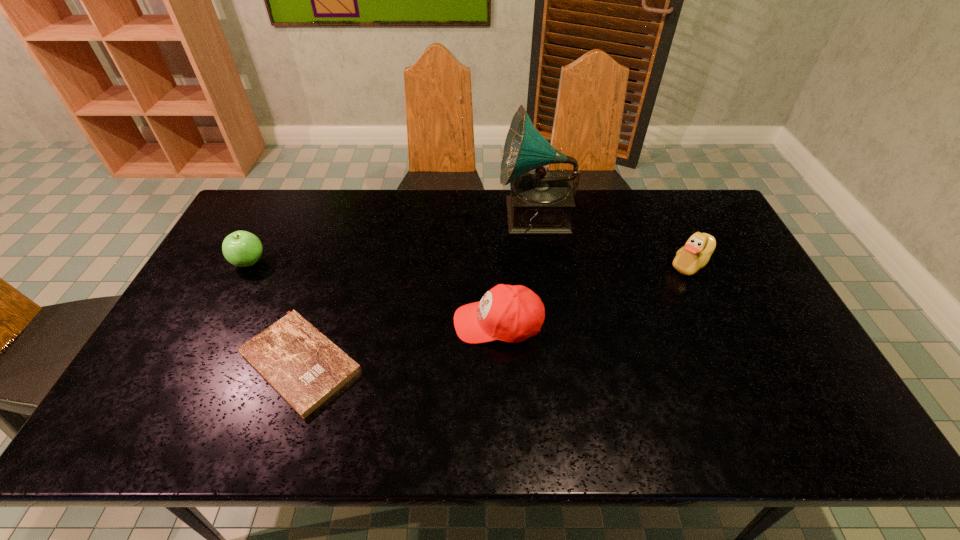
Find the location of a particular element. This screenshot has height=540, width=960. vacant area situated 0.170m at the beak of the duck is located at coordinates (613, 264).

Find the location of a particular element. vacant space located 0.120m at the beak of the duck is located at coordinates (629, 264).

In order to click on free location located at the beak of the duck in this screenshot , I will do `click(585, 264)`.

This screenshot has width=960, height=540. I want to click on vacant space located 0.360m on the front panel of the baseball cap, so click(x=323, y=323).

Where is `free region located 0.330m on the front panel of the baseball cap`? This screenshot has height=540, width=960. free region located 0.330m on the front panel of the baseball cap is located at coordinates (334, 323).

You are a GUI agent. You are given a task and a screenshot of the screen. Output one action in this format:
    pyautogui.click(x=<x>, y=<y>)
    Task: Click on the vacant region located 0.100m on the front panel of the baseball cap
    
    Given the screenshot: What is the action you would take?
    pyautogui.click(x=418, y=323)

Locate an element on the screen. The height and width of the screenshot is (540, 960). vacant space situated 0.110m on the right of the apple is located at coordinates (x=301, y=262).

This screenshot has height=540, width=960. I want to click on free spot located 0.080m on the back of the Bible, so click(x=323, y=293).

Find the location of a particular element. object located in the far edge section of the desktop is located at coordinates (540, 202).

I want to click on object positioned at the near edge, so click(306, 368).